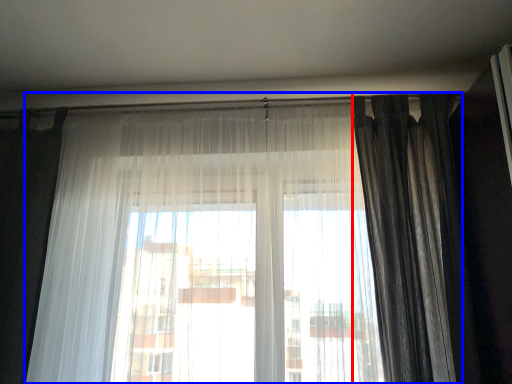
Question: Which of the following is the farthest to the observer, curtain (highlighted by a red box) or curtain (highlighted by a blue box)?

Choices:
 (A) curtain
 (B) curtain

Answer: (A)